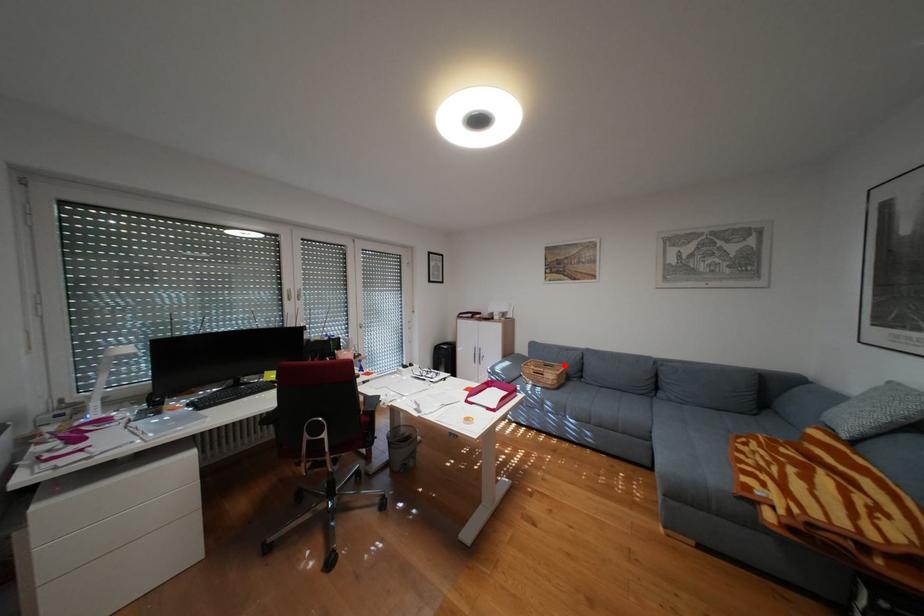
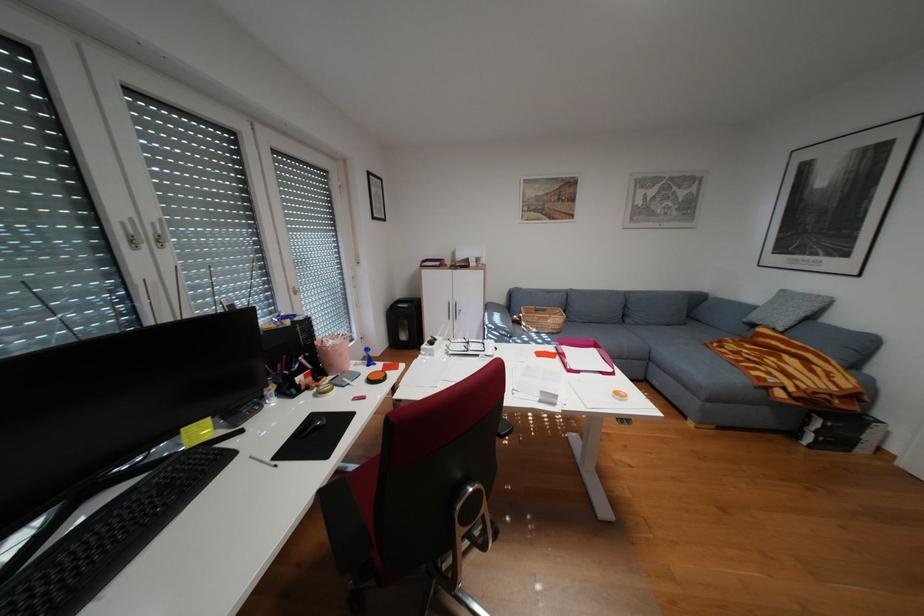
Find the pixel in the second image that matches the highlighted location in the first image.

(556, 310)